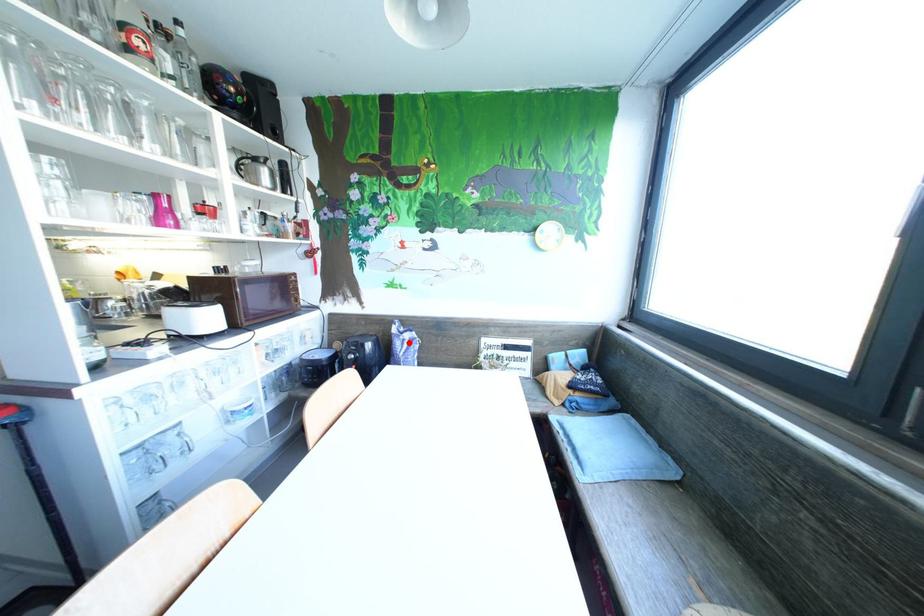
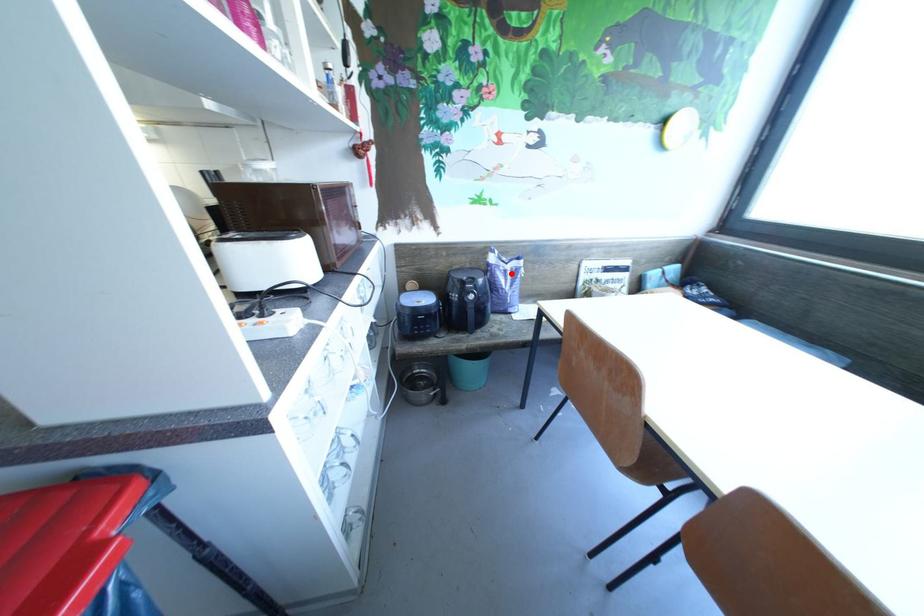
I am providing you with two images of the same scene from different viewpoints. A red point is marked on the first image and another point is marked on the second image. Does the point marked in image1 correspond to the same location as the one in image2?

Yes